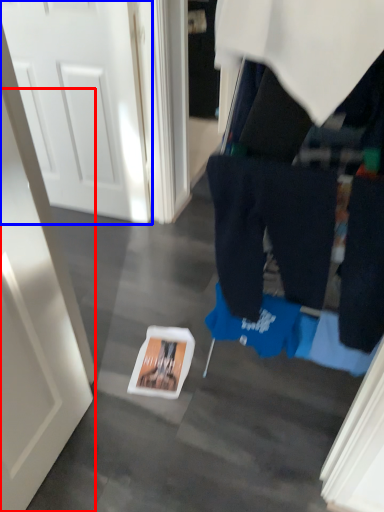
Question: Which point is further to the camera, door (highlighted by a red box) or door (highlighted by a blue box)?

Choices:
 (A) door
 (B) door

Answer: (B)